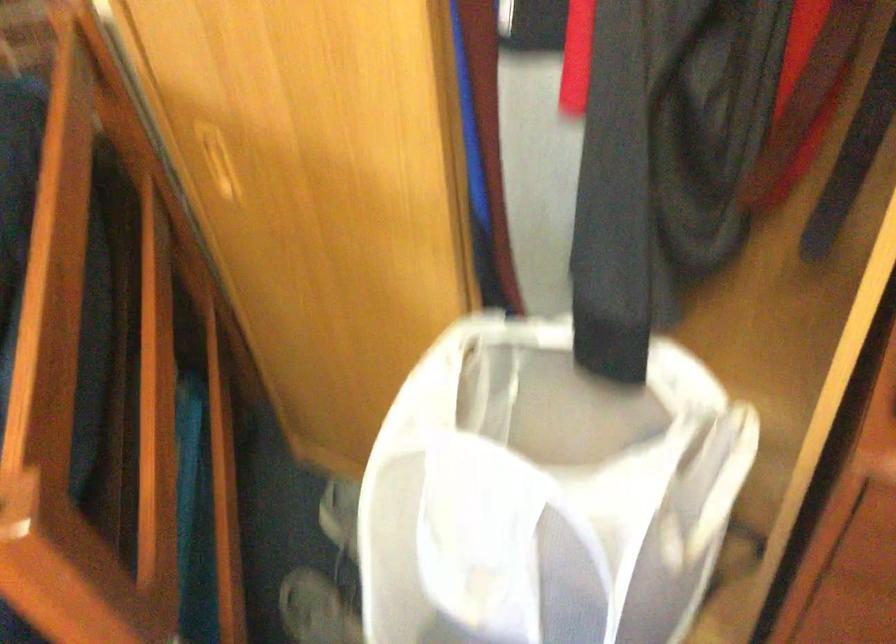
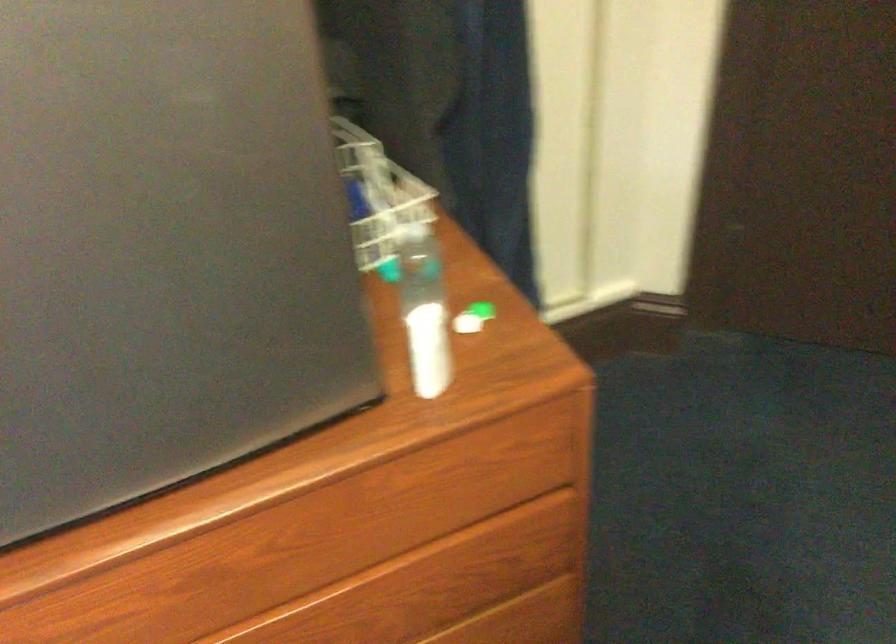
Question: The first image is from the beginning of the video and the second image is from the end. How did the camera likely rotate when shooting the video?

Choices:
 (A) Left
 (B) Right
 (C) Up
 (D) Down

Answer: (B)